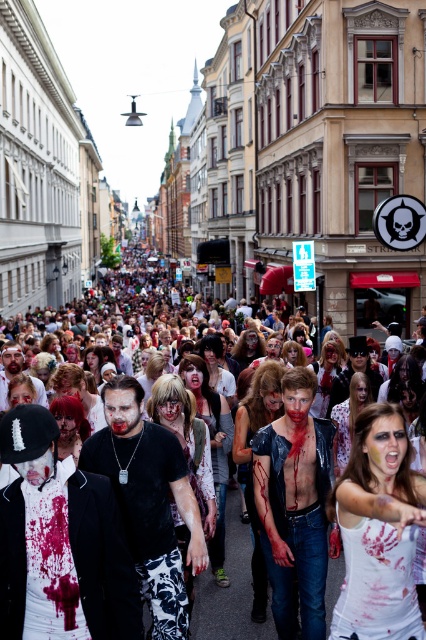
You are standing at the corner of the street and want to find the white matte suit at center. Based on its coordinates, in which direction should you look to see it?

The white matte suit at center is located at coordinates approximately 0.875 on the x axis and 0.242 on the y axis. Since the coordinate system is normalized, this would place it towards the upper right quadrant of the image. Therefore, you should look towards the upper right direction to see the white matte suit at center.

You are a photographer trying to capture a wide shot of the zombie parade. You notice two participants wearing white matte clothing. The first is wearing a white matte suit at center, and the second is wearing a white matte tank top at lower right. Which participant should you focus on to ensure the entire costume fits within your camera frame, considering their clothing widths?

The white matte suit at center has a greater width than the white matte tank top at lower right. To ensure the entire costume fits within your camera frame, you should focus on the white matte tank top at lower right since it is narrower.